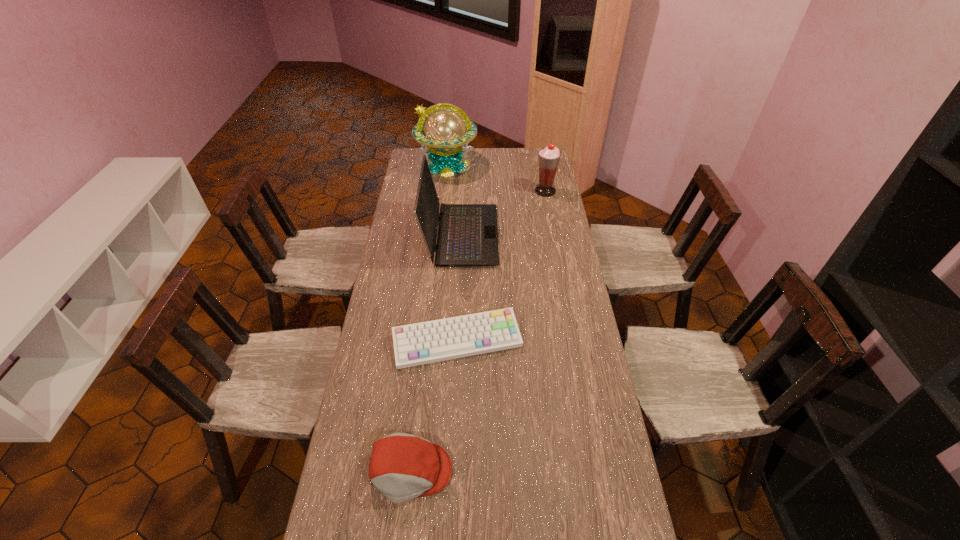
Locate an element on the screen. This screenshot has height=540, width=960. vacant position located on the screen of the laptop computer is located at coordinates (568, 235).

You are a GUI agent. You are given a task and a screenshot of the screen. Output one action in this format:
    pyautogui.click(x=<x>, y=<y>)
    Task: Click on the vacant space located 0.100m on the left of the smoothie
    
    Given the screenshot: What is the action you would take?
    pyautogui.click(x=515, y=191)

The height and width of the screenshot is (540, 960). I want to click on free spot located on the front of the shortest object, so pyautogui.click(x=454, y=407).

Locate an element on the screen. The image size is (960, 540). object that is positioned at the far edge is located at coordinates (447, 129).

Locate an element on the screen. Image resolution: width=960 pixels, height=540 pixels. globe at the left edge is located at coordinates (447, 129).

This screenshot has height=540, width=960. What are the coordinates of `laptop computer that is at the left edge` in the screenshot? It's located at (467, 235).

Where is `cap positioned at the left edge`? This screenshot has width=960, height=540. cap positioned at the left edge is located at coordinates (403, 467).

Where is `computer keyboard positioned at the left edge`? This screenshot has height=540, width=960. computer keyboard positioned at the left edge is located at coordinates (427, 342).

Locate an element on the screen. The width and height of the screenshot is (960, 540). object located at the right edge is located at coordinates (548, 157).

Where is `object positioned at the far left corner`? The width and height of the screenshot is (960, 540). object positioned at the far left corner is located at coordinates (447, 129).